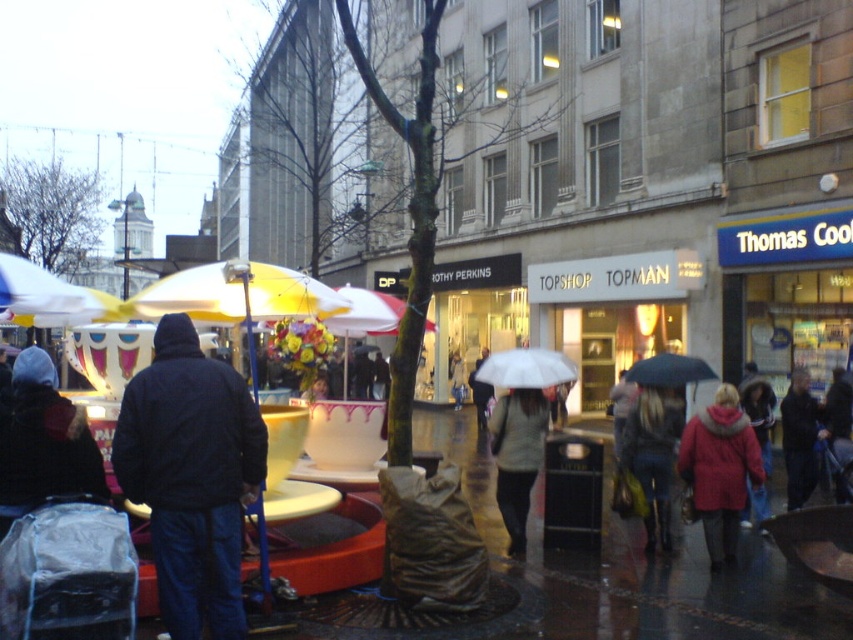
You are a fashion designer observing the urban street scene. You need to determine which clothing item is bigger between the matte black jacket at lower right and the gray knit sweater at center. Which one should you choose for a design that requires a larger garment?

The matte black jacket at lower right is larger in size than the gray knit sweater at center, so you should choose the matte black jacket at lower right for the design requiring a larger garment.

You are a pedestrian trying to cross the street and see the matte black jacket at lower right and the gray knit sweater at center. Which person is closer to you?

The matte black jacket at lower right is closer to you because it is in front of the gray knit sweater at center, which is positioned behind it.